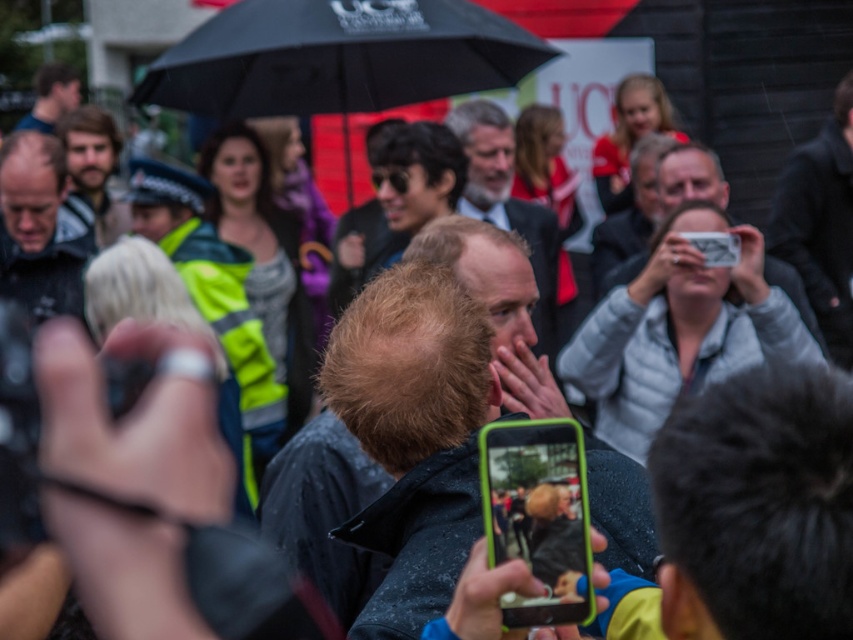
You are a photographer at the event and need to capture a clear shot of the matte black phone at center and the smooth bald head at left. Which object is smaller in size?

The matte black phone at center has a smaller size compared to the smooth bald head at left, so the matte black phone at center is the smaller object.

You are a photographer at the event and want to capture the crowd holding phones and cameras without any obstruction. You notice a black matte umbrella at center at point [338,58]. Where should you position yourself to avoid it?

To avoid the black matte umbrella at center at point [338,58], position yourself either to the left or right of the umbrella, ensuring it is not in the frame.

Consider the image. You are a photographer at the event and need to capture both the matte black phone at center and the smooth gray suit at center in a single frame. Given their sizes, which object should you focus on to ensure both are visible without cropping?

Since the matte black phone at center is smaller than the smooth gray suit at center, you should focus on the smooth gray suit at center to ensure both objects fit within the frame.